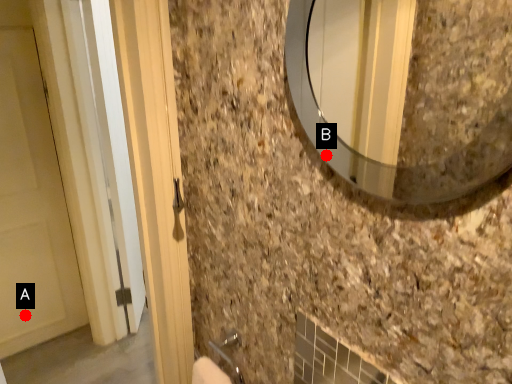
Question: Two points are circled on the image, labeled by A and B beside each circle. Which point appears closest to the camera in this image?

Choices:
 (A) A is closer
 (B) B is closer

Answer: (B)